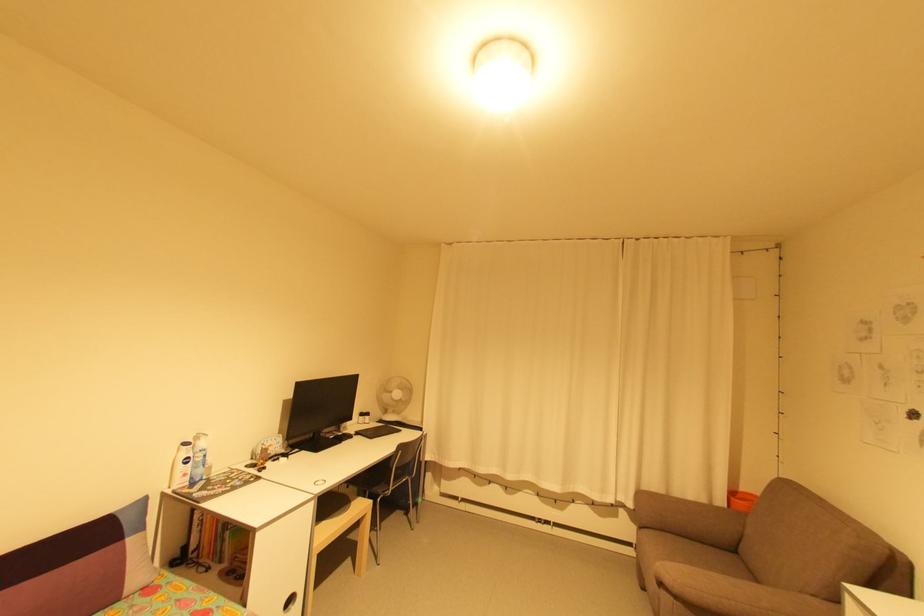
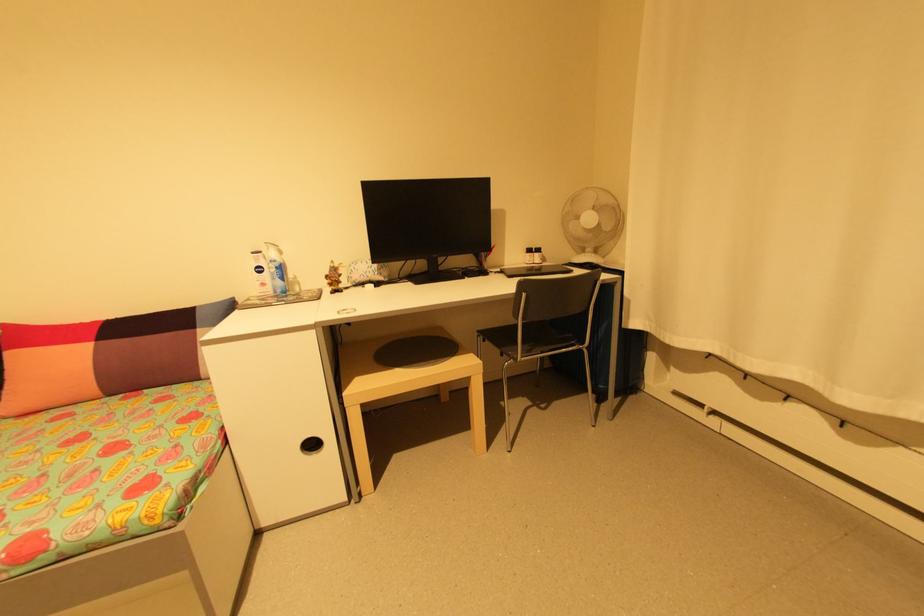
In the second image, find the point that corresponds to point 350,507 in the first image.

(445, 360)